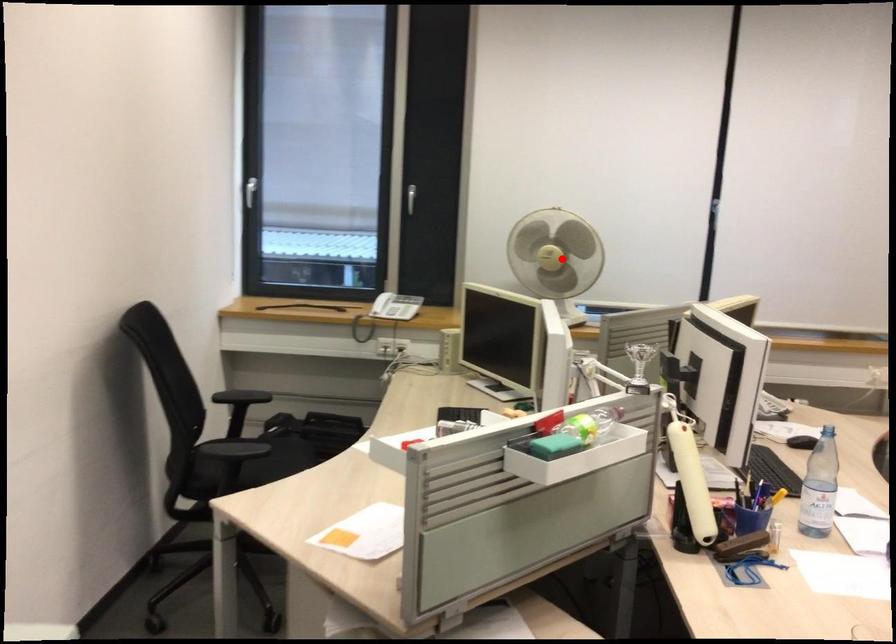
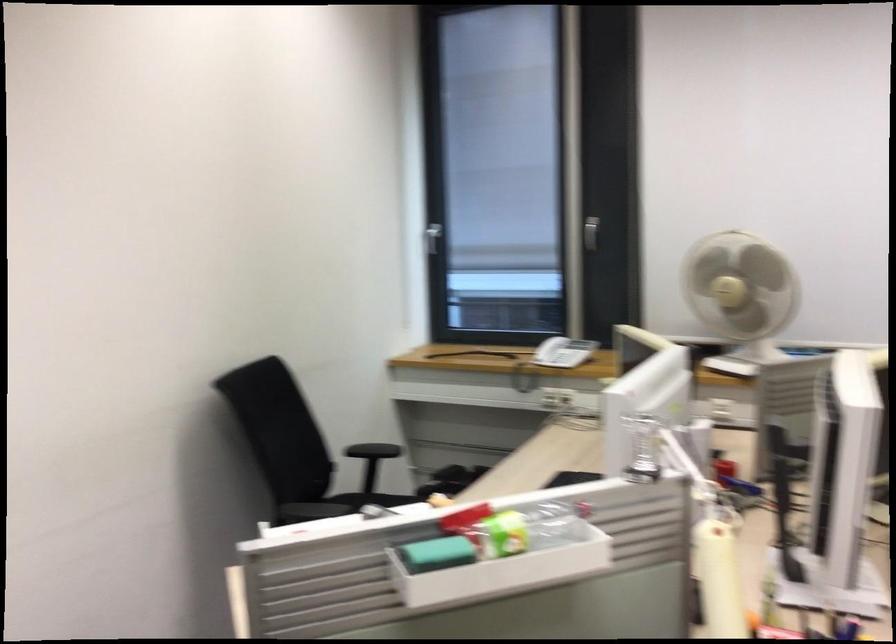
Question: I am providing you with two images of the same scene from different viewpoints. Image1 has a red point marked. In image2, the corresponding 3D location appears at what relative position? Reply with the corresponding letter.

Choices:
 (A) Closer
 (B) Farther

Answer: (A)